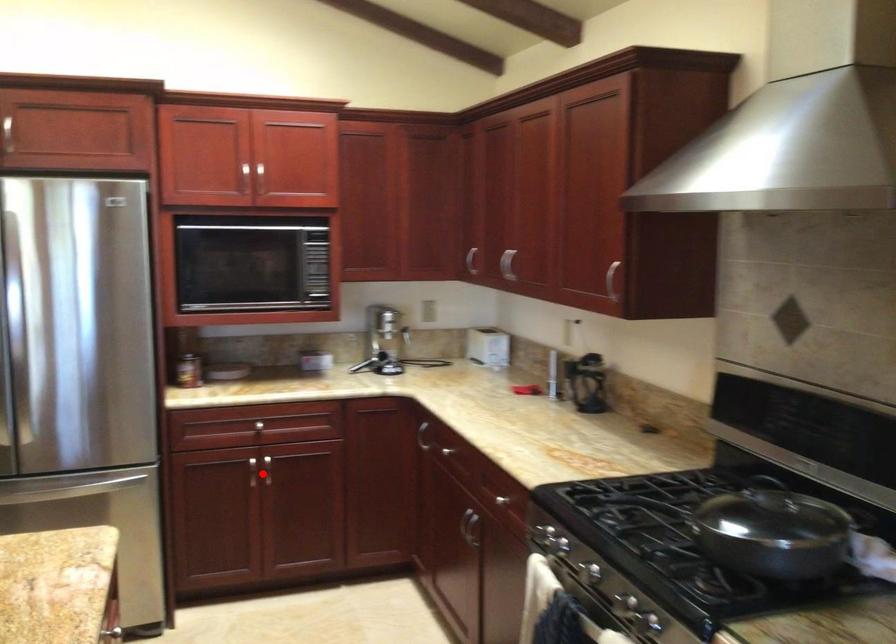
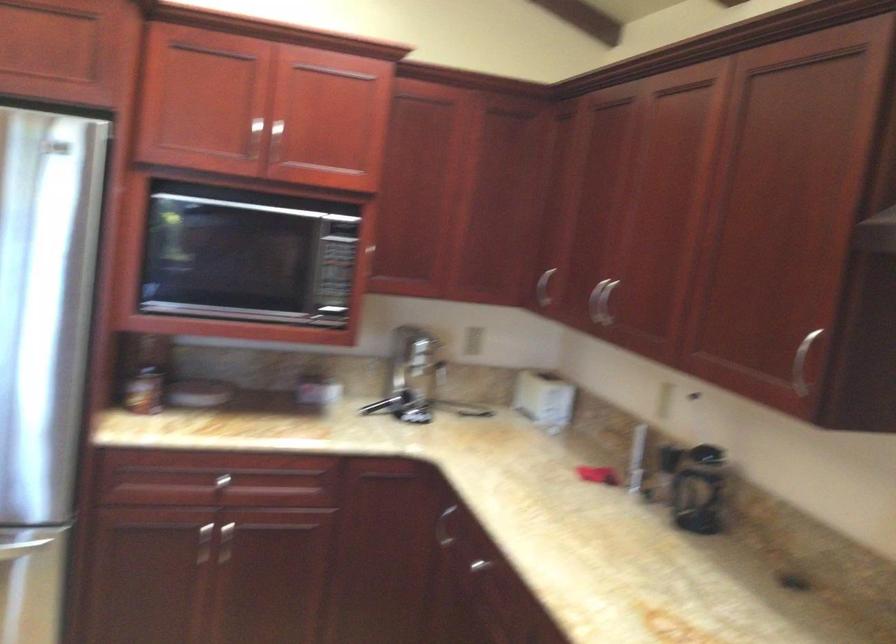
In the second image, find the point that corresponds to the highlighted location in the first image.

(222, 543)